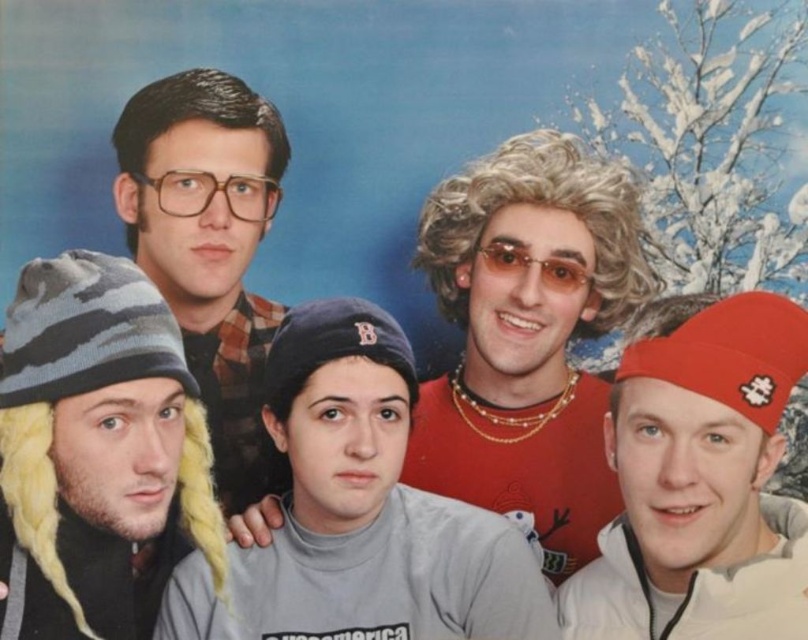
You are standing in front of the group photo with the snowy backdrop. You notice two points marked in the image at coordinates point (343, 627) and point (238, 195). From your perspective, which point is closer to you?

Point (343, 627) is in front of point (238, 195), so it is closer to you.

You are a photographer setting up for a group photo. You notice two accessories in the scene that might reflect light. The shiny gold necklace at center and the matte black glasses at upper left. Which accessory is more likely to cause glare in your photos?

The shiny gold necklace at center is more likely to cause glare in your photos because its width is larger than the matte black glasses at upper left, making it more reflective and prone to catching light.